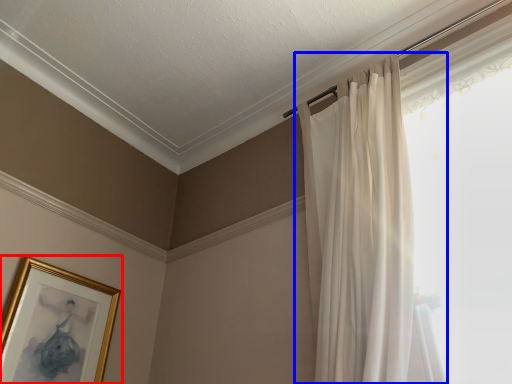
Question: Which object is further to the camera taking this photo, picture frame (highlighted by a red box) or curtain (highlighted by a blue box)?

Choices:
 (A) picture frame
 (B) curtain

Answer: (A)